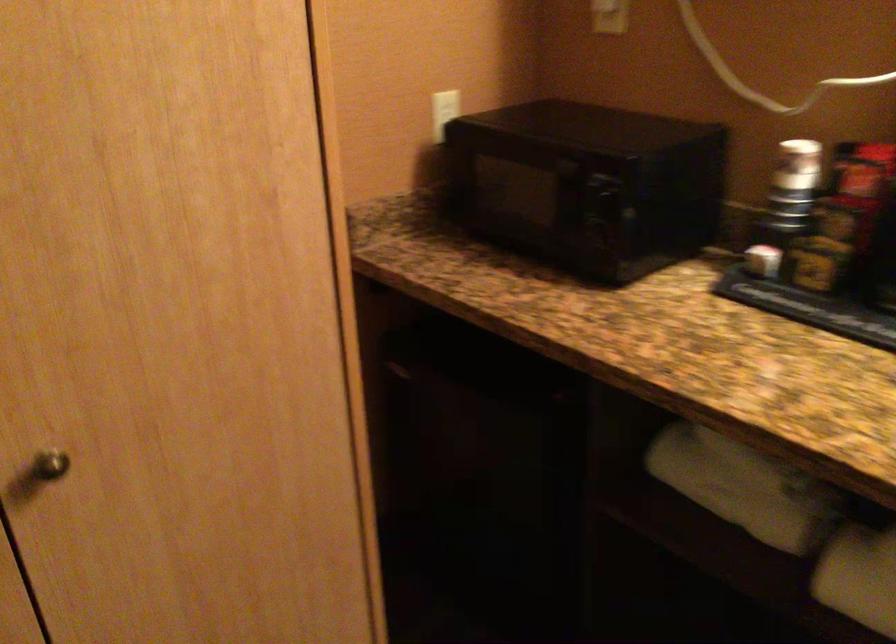
Find where to lift the paper cup. Please return your answer as a coordinate pair (x, y).

(797, 164)